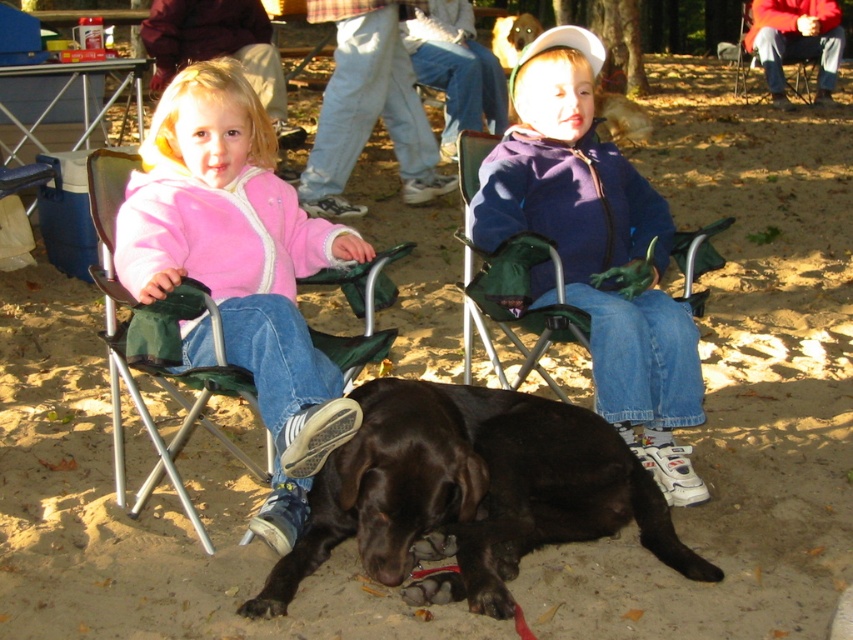
You are a photographer trying to capture a group photo of the shiny black dog at center and the purple fleece jacket at center. Since you want them both in the frame, which one should you position closer to the left side of the camera viewfinder?

The shiny black dog at center should be positioned closer to the left side of the camera viewfinder because it is already to the left of the purple fleece jacket at center.

You are a photographer trying to capture a candid shot of the two children sitting on the beach. You want to ensure there is enough space between them to frame each child individually without overlapping. Given that your camera has a minimum focus distance of 60 centimeters, can you determine if the distance between the pink fleece jacket at left and the purple fleece jacket at center allows for this framing?

The distance between the pink fleece jacket at left and the purple fleece jacket at center is 72.55 centimeters, which exceeds the camera minimum focus distance of 60 centimeters. This means there is sufficient space to frame each child individually without overlapping.

You are a photographer trying to capture a photo of the shiny black dog at center and the purple fleece jacket at center. Since you want to focus on the dog, which object should you adjust your camera to prioritize in terms of depth of field?

The shiny black dog at center is closer to the viewer than the purple fleece jacket at center, so you should adjust your camera to prioritize the shiny black dog at center in terms of depth of field to ensure it is in focus.